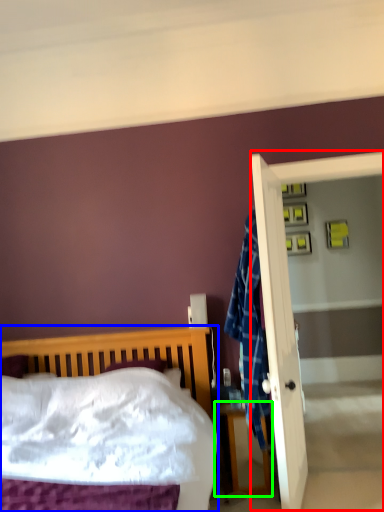
Question: Which object is positioned closest to screen door (highlighted by a red box)? Select from bed (highlighted by a blue box) and nightstand (highlighted by a green box).

Choices:
 (A) bed
 (B) nightstand

Answer: (B)